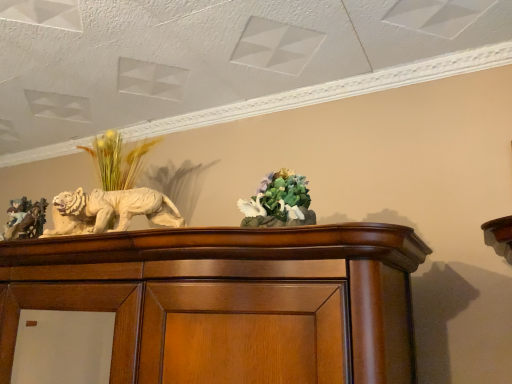
Question: In terms of size, does matte brown figurine at left appear bigger or smaller than white glossy sculpture at left?

Choices:
 (A) big
 (B) small

Answer: (B)

Question: In terms of height, does matte brown figurine at left look taller or shorter compared to white glossy sculpture at left?

Choices:
 (A) short
 (B) tall

Answer: (B)

Question: Which of these objects is positioned farthest from the matte brown figurine at left?

Choices:
 (A) green matte floral arrangement at center
 (B) white glossy sculpture at left

Answer: (A)

Question: Considering the real-world distances, which object is farthest from the matte brown figurine at left?

Choices:
 (A) white glossy sculpture at left
 (B) green matte floral arrangement at center

Answer: (B)